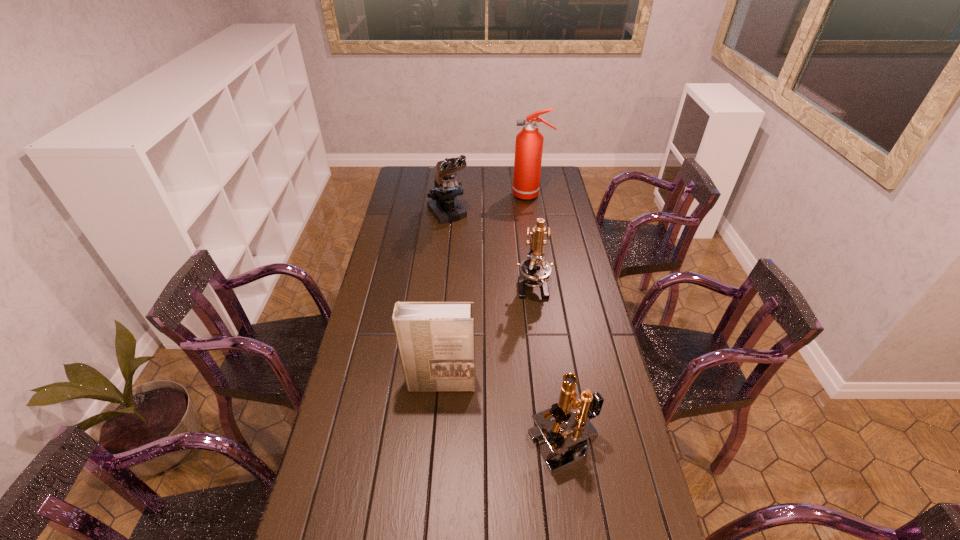
Where is `fire extinguisher`? The image size is (960, 540). fire extinguisher is located at coordinates (529, 142).

Image resolution: width=960 pixels, height=540 pixels. Identify the location of the farthest microscope. point(446,208).

This screenshot has width=960, height=540. In order to click on the second farthest microscope in this screenshot , I will do `click(535, 271)`.

The height and width of the screenshot is (540, 960). In order to click on the second nearest object in this screenshot , I will do `click(436, 343)`.

The height and width of the screenshot is (540, 960). Identify the location of the nearest object. (561, 428).

At what (x,y) coordinates should I click in order to perform the action: click on vacant space located 0.350m at the nozzle of the fire extinguisher. Please return your answer as a coordinate pair (x, y). The width and height of the screenshot is (960, 540). Looking at the image, I should click on (443, 195).

Locate an element on the screen. vacant area located at the nozzle of the fire extinguisher is located at coordinates (446, 195).

Where is `vacant region located 0.270m at the nozzle of the fire extinguisher`? The width and height of the screenshot is (960, 540). vacant region located 0.270m at the nozzle of the fire extinguisher is located at coordinates (459, 195).

Image resolution: width=960 pixels, height=540 pixels. What are the coordinates of `vacant area situated on the right of the leftmost microscope` in the screenshot? It's located at (552, 214).

This screenshot has width=960, height=540. I want to click on vacant area situated 0.210m at the eyepiece of the third farthest object, so click(540, 348).